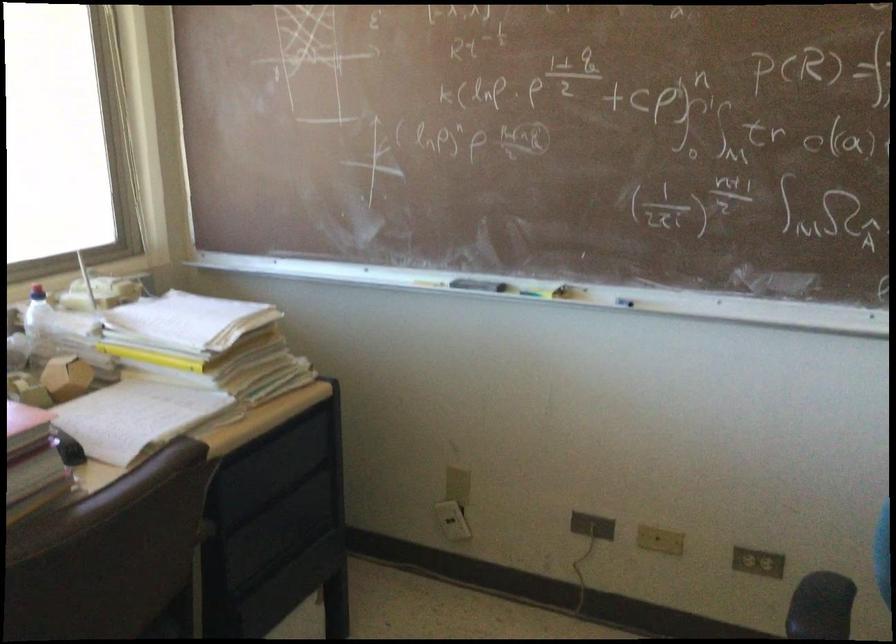
Locate an element on the screen. The image size is (896, 644). white chalk piece is located at coordinates (135, 417).